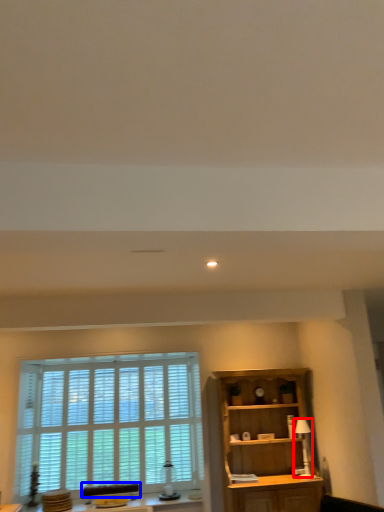
Question: Among these objects, which one is farthest to the camera, lamp (highlighted by a red box) or swivel chair (highlighted by a blue box)?

Choices:
 (A) lamp
 (B) swivel chair

Answer: (B)